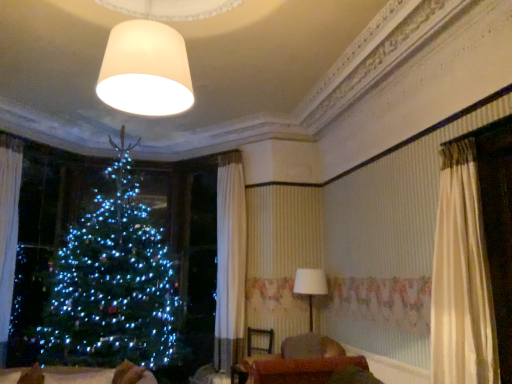
Question: Is velvet brown sofa at lower center further to the viewer compared to white fabric lampshade at center, which is the 2th lamp from top to bottom?

Choices:
 (A) yes
 (B) no

Answer: (B)

Question: Would you say white fabric lampshade at center, which is the first lamp from back to front, is part of velvet brown sofa at lower center's contents?

Choices:
 (A) no
 (B) yes

Answer: (A)

Question: Is velvet brown sofa at lower center turned away from white fabric lampshade at center, the 1th lamp positioned from the right?

Choices:
 (A) yes
 (B) no

Answer: (B)

Question: From a real-world perspective, is velvet brown sofa at lower center under white fabric lampshade at center, acting as the 2th lamp starting from the left?

Choices:
 (A) no
 (B) yes

Answer: (B)

Question: Does velvet brown sofa at lower center have a greater width compared to white fabric lampshade at center, the first lamp in the bottom-to-top sequence?

Choices:
 (A) no
 (B) yes

Answer: (B)

Question: Does velvet brown sofa at lower center have a lesser height compared to white fabric lampshade at center, the first lamp in the bottom-to-top sequence?

Choices:
 (A) yes
 (B) no

Answer: (A)

Question: Is velvet brown armchair at center positioned beyond the bounds of white fabric lampshade at center, which is the first lamp from back to front?

Choices:
 (A) yes
 (B) no

Answer: (A)

Question: Can you confirm if velvet brown armchair at center is positioned to the right of white fabric lampshade at center, which is the 2th lamp from top to bottom?

Choices:
 (A) no
 (B) yes

Answer: (A)

Question: From the image's perspective, is velvet brown armchair at center over white fabric lampshade at center, acting as the 2th lamp starting from the left?

Choices:
 (A) yes
 (B) no

Answer: (B)

Question: Is velvet brown armchair at center positioned with its back to white fabric lampshade at center, which is the first lamp from back to front?

Choices:
 (A) yes
 (B) no

Answer: (B)

Question: From a real-world perspective, is velvet brown armchair at center physically below white fabric lampshade at center, positioned as the 2th lamp in front-to-back order?

Choices:
 (A) yes
 (B) no

Answer: (A)

Question: Is velvet brown armchair at center not close to white fabric lampshade at center, which is the first lamp from back to front?

Choices:
 (A) yes
 (B) no

Answer: (B)

Question: Does velvet brown sofa at lower center appear on the left side of white sheer curtain at left?

Choices:
 (A) yes
 (B) no

Answer: (B)